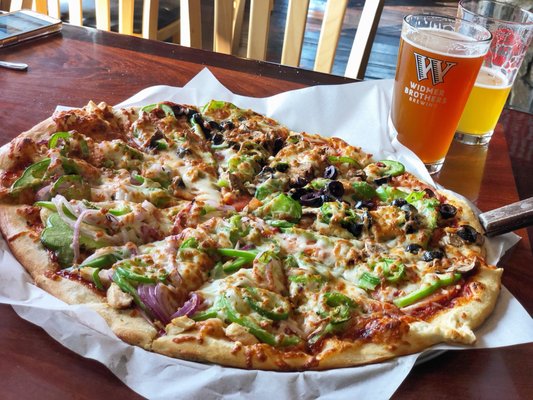
Image resolution: width=533 pixels, height=400 pixels. In order to click on table in this screenshot , I will do `click(447, 378)`.